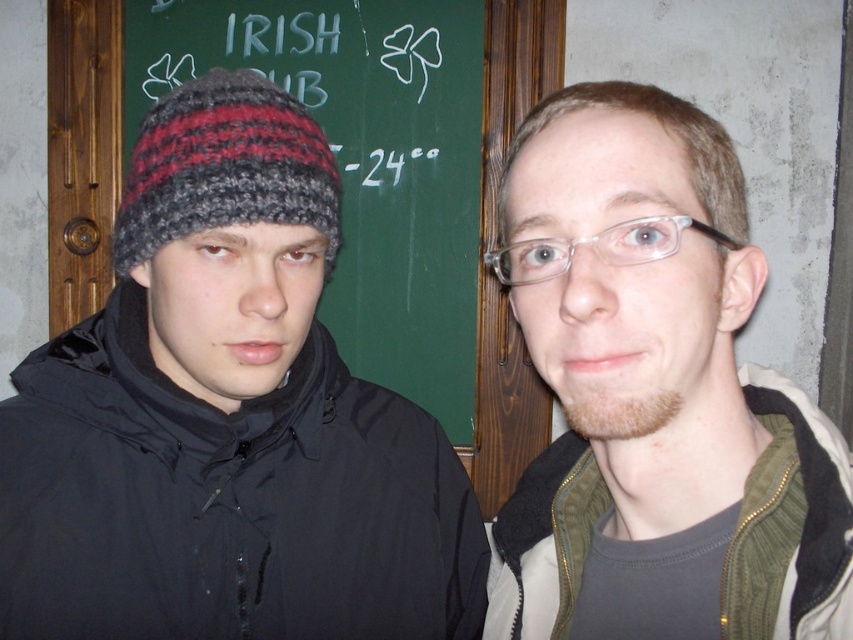
Question: Which of the following is the closest to the observer?

Choices:
 (A) (368, 570)
 (B) (689, 112)
 (C) (473, 33)

Answer: (B)

Question: Among these points, which one is nearest to the camera?

Choices:
 (A) (312, 179)
 (B) (456, 376)
 (C) (271, 144)
 (D) (815, 472)

Answer: (D)

Question: Observing the image, what is the correct spatial positioning of matte green jacket at center in reference to knitted woolen beanie at left?

Choices:
 (A) right
 (B) left

Answer: (A)

Question: Which object is closer to the camera taking this photo?

Choices:
 (A) knitted woolen hat at left
 (B) green chalkboard at upper center
 (C) knitted woolen beanie at left
 (D) matte green jacket at center

Answer: (D)

Question: Is green chalkboard at upper center above knitted woolen beanie at left?

Choices:
 (A) no
 (B) yes

Answer: (B)

Question: Is knitted woolen hat at left further to the viewer compared to matte green jacket at center?

Choices:
 (A) yes
 (B) no

Answer: (A)